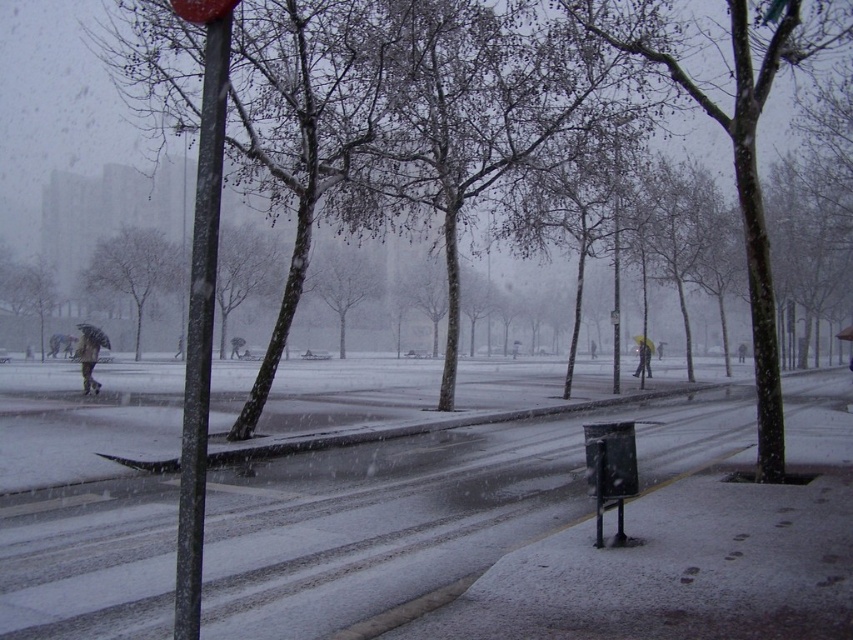
Does snow-covered concrete at lower left appear over smooth gray tree at center?

Actually, snow-covered concrete at lower left is below smooth gray tree at center.

Does snow-covered concrete at lower left have a greater width compared to smooth gray tree at center?

Correct, the width of snow-covered concrete at lower left exceeds that of smooth gray tree at center.

The image size is (853, 640). Describe the element at coordinates (376, 524) in the screenshot. I see `snow-covered concrete at lower left` at that location.

What are the coordinates of `snow-covered concrete at lower left` in the screenshot? It's located at (376, 524).

Between snow-covered concrete at lower left and brown leather coat at left, which one has less height?

snow-covered concrete at lower left

Is snow-covered concrete at lower left closer to the viewer compared to brown leather coat at left?

Yes, snow-covered concrete at lower left is in front of brown leather coat at left.

Where is `snow-covered concrete at lower left`? The height and width of the screenshot is (640, 853). snow-covered concrete at lower left is located at coordinates (376, 524).

Which of these two, metallic pole at left or metallic bus stop at lower right, stands shorter?

With less height is metallic bus stop at lower right.

This screenshot has width=853, height=640. What do you see at coordinates (200, 307) in the screenshot?
I see `metallic pole at left` at bounding box center [200, 307].

Is point (207, 56) positioned in front of point (596, 547)?

Yes, it is.

Image resolution: width=853 pixels, height=640 pixels. In order to click on metallic pole at left in this screenshot , I will do `click(200, 307)`.